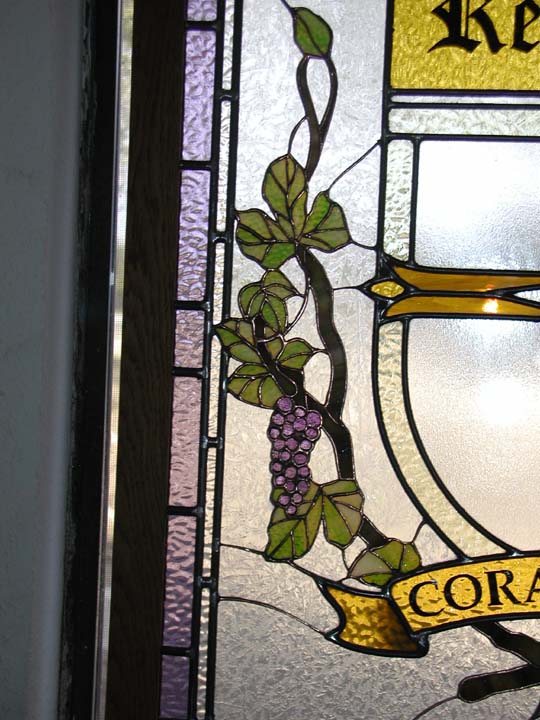
At what (x,y) coordinates should I click in order to perform the action: click on space between door/window and wall created by hinge. Please return your answer as a coordinate pair (x, y). Image resolution: width=540 pixels, height=720 pixels. Looking at the image, I should click on (111, 454).